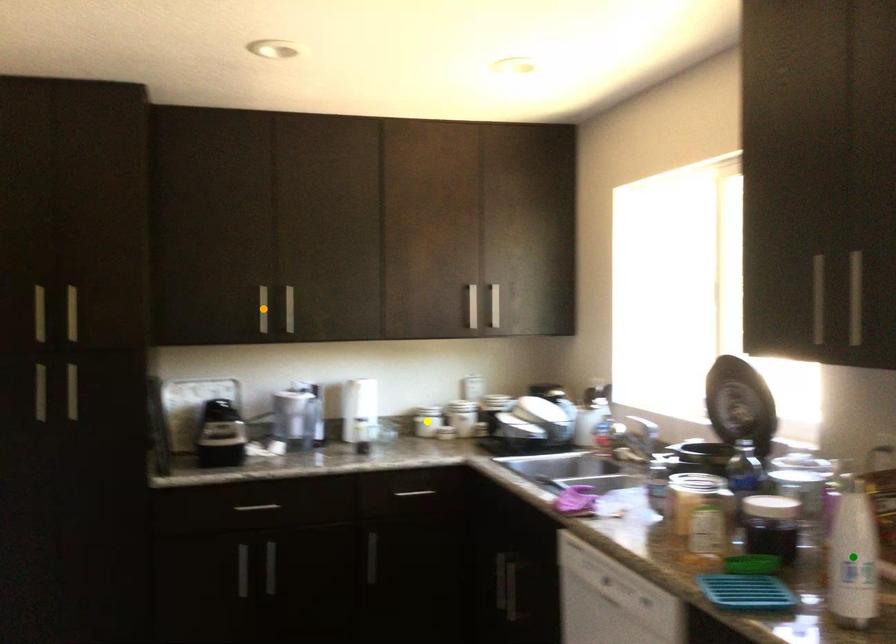
From the picture: Order these from nearest to farthest:
1. green point
2. yellow point
3. orange point

yellow point → orange point → green point